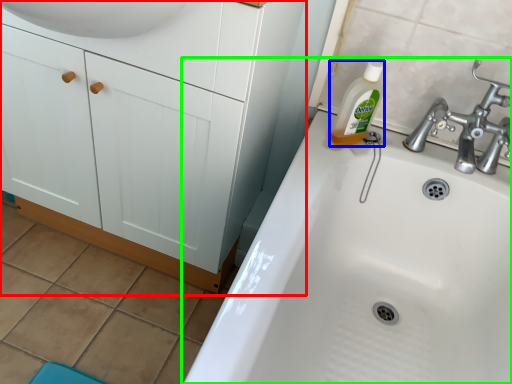
Question: Which is farther away from bathroom cabinet (highlighted by a red box)? cleaning product (highlighted by a blue box) or sink (highlighted by a green box)?

Choices:
 (A) cleaning product
 (B) sink

Answer: (A)